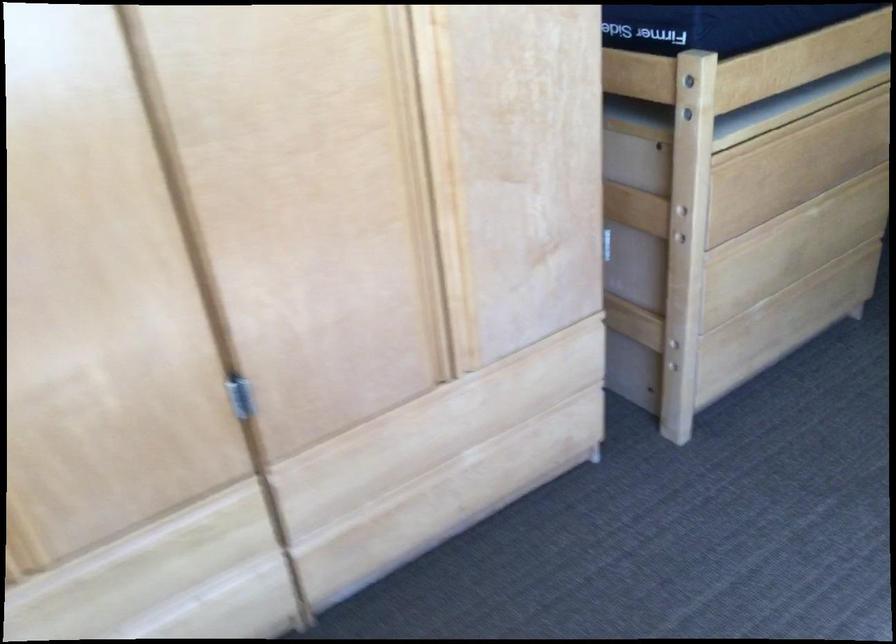
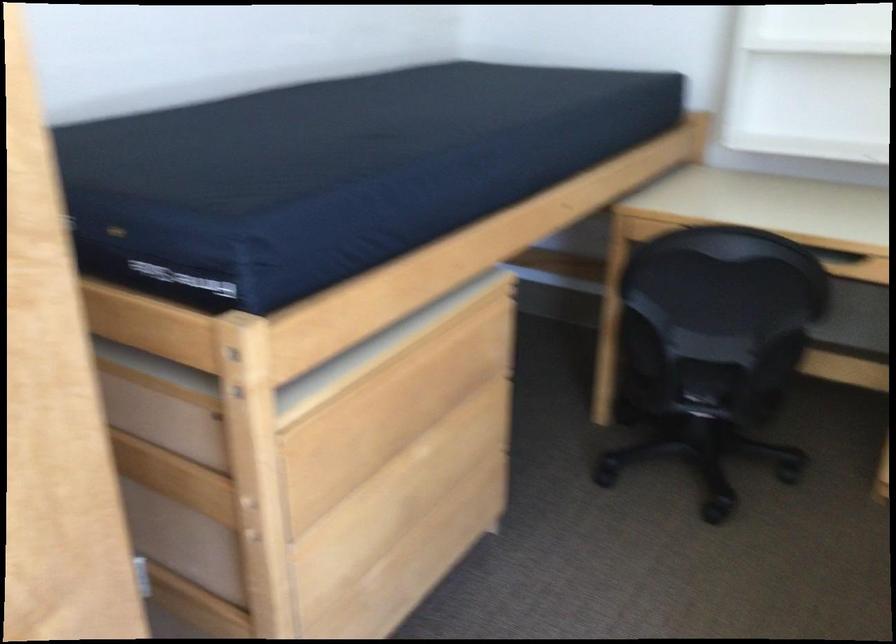
Find the pixel in the second image that matches (799,283) in the first image.

(427, 532)